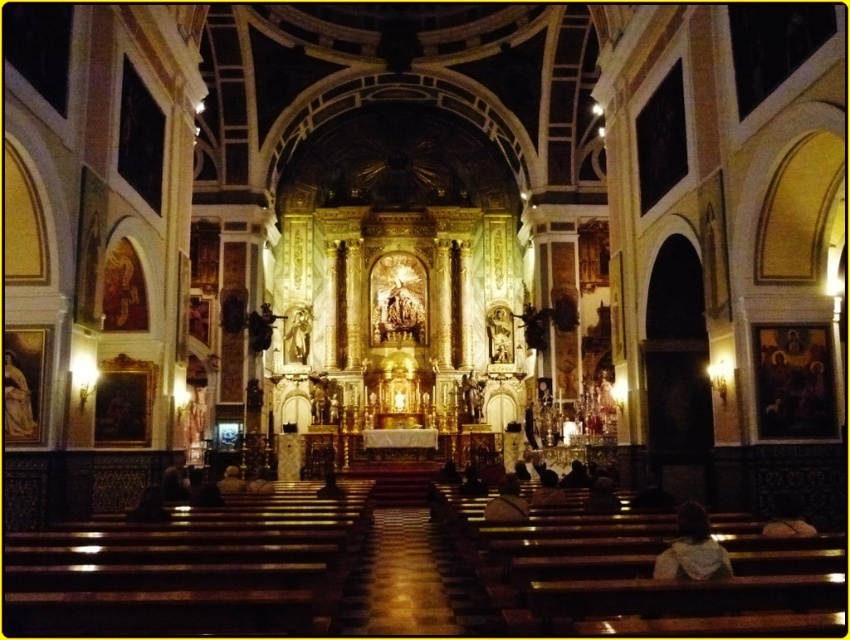
Question: Which object appears closest to the camera in this image?

Choices:
 (A) dark brown leather shoe at lower center
 (B) light brown leather jacket at lower right
 (C) dark brown leather jacket at lower center
 (D) brown leather jacket at lower right

Answer: (B)

Question: Does dark brown leather shoe at lower center appear on the left side of dark brown leather jacket at lower center?

Choices:
 (A) yes
 (B) no

Answer: (A)

Question: Does light brown leather jacket at lower right appear on the right side of dark brown leather jacket at lower center?

Choices:
 (A) no
 (B) yes

Answer: (B)

Question: Which point is farther to the camera?

Choices:
 (A) (728, 563)
 (B) (556, 476)

Answer: (B)

Question: Among these objects, which one is nearest to the camera?

Choices:
 (A) brown leather jacket at lower right
 (B) light brown leather jacket at lower right

Answer: (B)

Question: From the image, what is the correct spatial relationship of light brown leather jacket at lower right in relation to brown leather jacket at lower right?

Choices:
 (A) left
 (B) right

Answer: (A)